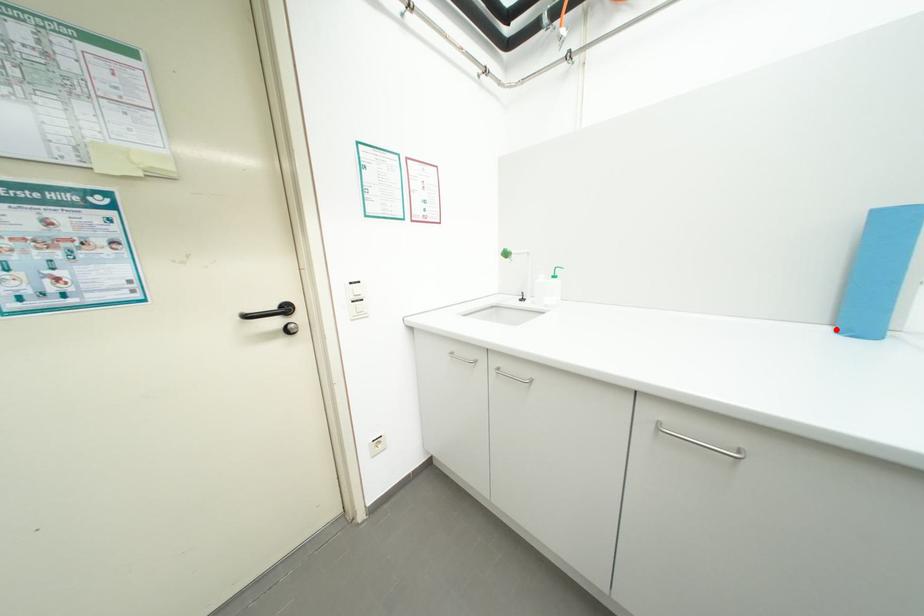
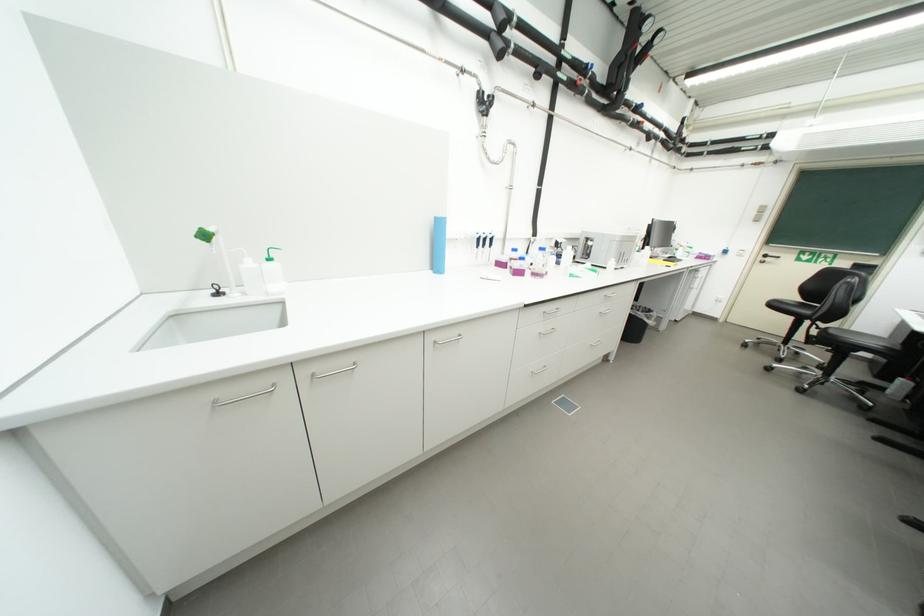
Find the pixel in the second image that matches the highlighted location in the first image.

(439, 273)